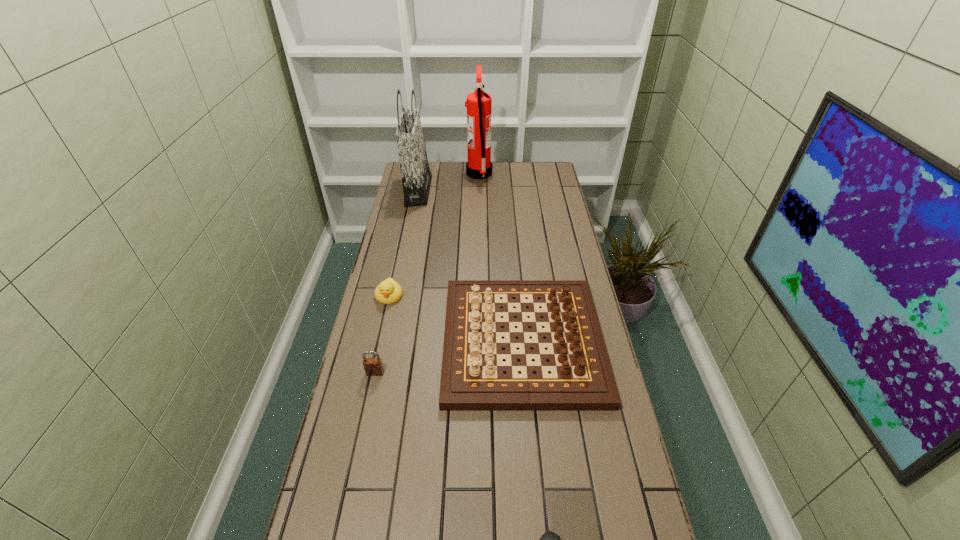
The width and height of the screenshot is (960, 540). In order to click on object that is the nearest to the padlock in this screenshot , I will do `click(472, 378)`.

Find the location of a particular element. The height and width of the screenshot is (540, 960). vacant space that satisfies the following two spatial constraints: 1. on the side with the white pieces of the gameboard; 2. on the front-facing side of the padlock is located at coordinates (525, 373).

The width and height of the screenshot is (960, 540). In order to click on free spot that satisfies the following two spatial constraints: 1. with the nozzle aimed from the fire extinguisher; 2. on the front-facing side of the padlock in this screenshot , I will do `click(479, 373)`.

The width and height of the screenshot is (960, 540). Find the location of `vacant area in the image that satisfies the following two spatial constraints: 1. with the nozzle aimed from the fire extinguisher; 2. on the front-facing side of the padlock`. vacant area in the image that satisfies the following two spatial constraints: 1. with the nozzle aimed from the fire extinguisher; 2. on the front-facing side of the padlock is located at coordinates (479, 373).